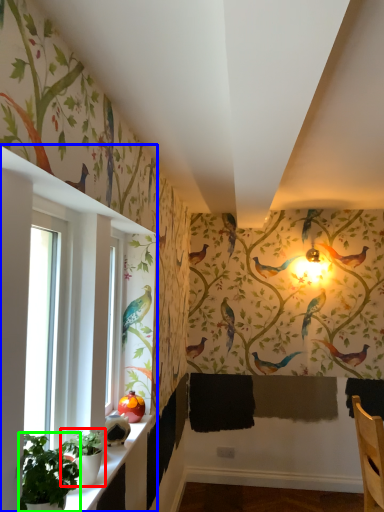
Question: Which object is the farthest from plant (highlighted by a red box)? Choose among these: window (highlighted by a blue box) or plant (highlighted by a green box).

Choices:
 (A) window
 (B) plant

Answer: (A)